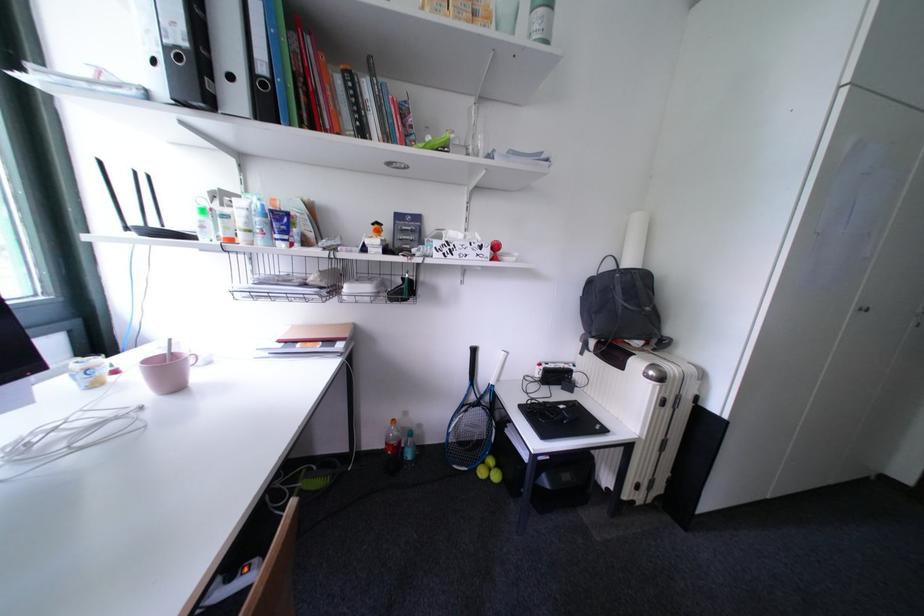
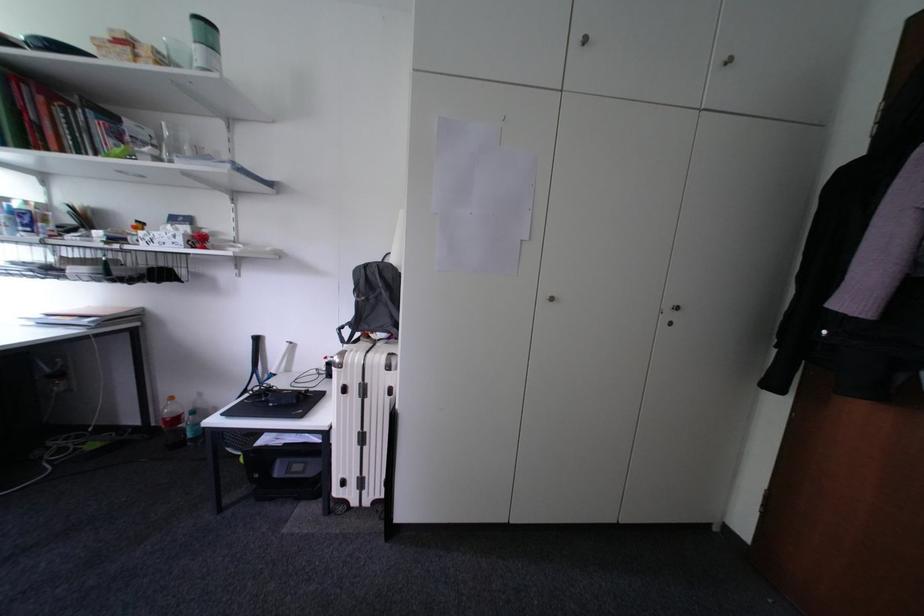
Where in the second image is the point corresponding to pixel 671 405 from the first image?

(353, 392)